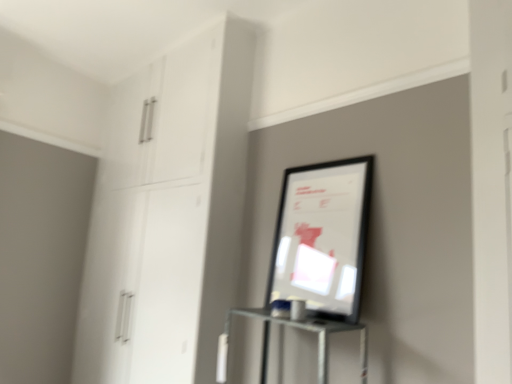
Question: Do you think white glossy cabinet at upper left is within matte black picture frame at center, or outside of it?

Choices:
 (A) inside
 (B) outside

Answer: (B)

Question: Is white glossy cabinet at upper left wider or thinner than matte black picture frame at center?

Choices:
 (A) wide
 (B) thin

Answer: (A)

Question: Considering their positions, is white glossy cabinet at upper left located in front of or behind matte black picture frame at center?

Choices:
 (A) front
 (B) behind

Answer: (B)

Question: Considering the positions of matte black picture frame at center and white glossy cabinet at upper left in the image, is matte black picture frame at center wider or thinner than white glossy cabinet at upper left?

Choices:
 (A) wide
 (B) thin

Answer: (B)

Question: Is matte black picture frame at center bigger or smaller than white glossy cabinet at upper left?

Choices:
 (A) big
 (B) small

Answer: (B)

Question: From a real-world perspective, is matte black picture frame at center positioned above or below white glossy cabinet at upper left?

Choices:
 (A) below
 (B) above

Answer: (A)

Question: Is matte black picture frame at center to the left or to the right of white glossy cabinet at upper left in the image?

Choices:
 (A) left
 (B) right

Answer: (B)